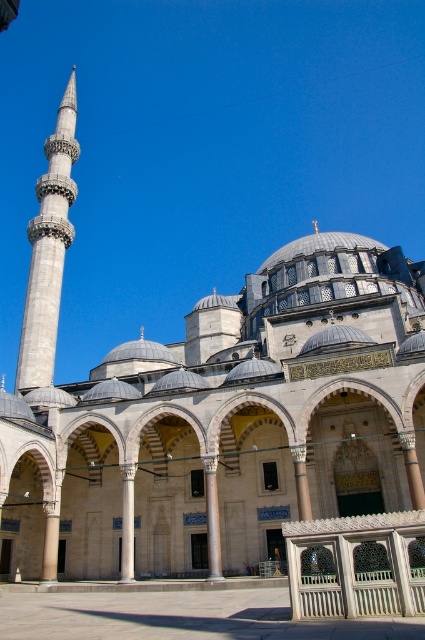
Is gray stone minaret at left below white marble pillar at center?

No, gray stone minaret at left is not below white marble pillar at center.

Who is shorter, gray stone minaret at left or white marble pillar at center?

white marble pillar at center

The image size is (425, 640). In order to click on gray stone minaret at left in this screenshot , I will do `click(48, 250)`.

Image resolution: width=425 pixels, height=640 pixels. What are the coordinates of `gray stone minaret at left` in the screenshot? It's located at (48, 250).

Between slate stone column at center and white marble pillar at center, which one appears on the left side from the viewer's perspective?

white marble pillar at center is more to the left.

Does point (212, 564) come behind point (130, 488)?

No, it is in front of (130, 488).

Find the location of `slate stone column at center`. slate stone column at center is located at coordinates (212, 516).

What do you see at coordinates (48, 250) in the screenshot? The image size is (425, 640). I see `gray stone minaret at left` at bounding box center [48, 250].

Can you confirm if gray stone minaret at left is positioned below slate stone column at center?

No.

Is point (71, 154) in front of point (217, 493)?

That is False.

Image resolution: width=425 pixels, height=640 pixels. In order to click on gray stone minaret at left in this screenshot , I will do pos(48,250).